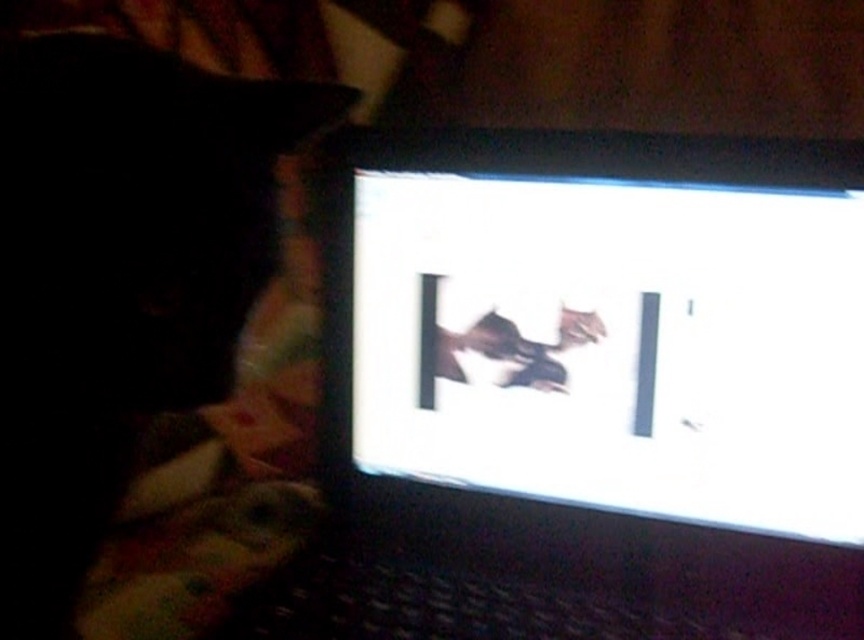
Question: Is matte black laptop at center to the right of matte black laptop at upper right from the viewer's perspective?

Choices:
 (A) no
 (B) yes

Answer: (B)

Question: Which point appears closest to the camera in this image?

Choices:
 (A) (140, 124)
 (B) (659, 525)

Answer: (A)

Question: Among these points, which one is farthest from the camera?

Choices:
 (A) (27, 108)
 (B) (453, 305)

Answer: (B)

Question: Which point is closer to the camera taking this photo?

Choices:
 (A) (690, 632)
 (B) (4, 605)

Answer: (B)

Question: Can you confirm if matte black laptop at center is bigger than matte black laptop at upper right?

Choices:
 (A) no
 (B) yes

Answer: (B)

Question: Can you confirm if matte black laptop at center is thinner than matte black laptop at upper right?

Choices:
 (A) no
 (B) yes

Answer: (A)